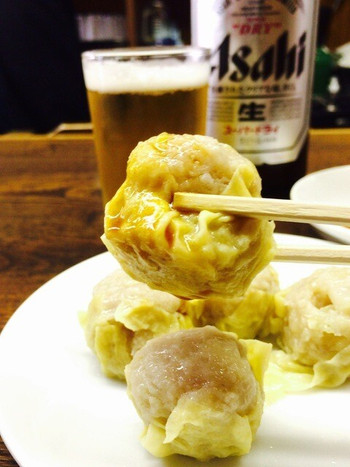
I want to click on beer in glass, so click(x=188, y=96).